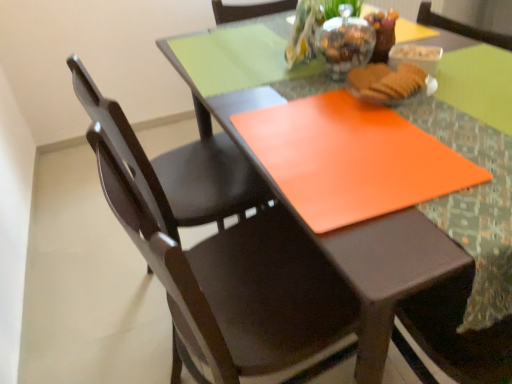
Image resolution: width=512 pixels, height=384 pixels. What are the coordinates of `vacant area on top of orange matte placemat at center (from a real-world perspective)` in the screenshot? It's located at (353, 96).